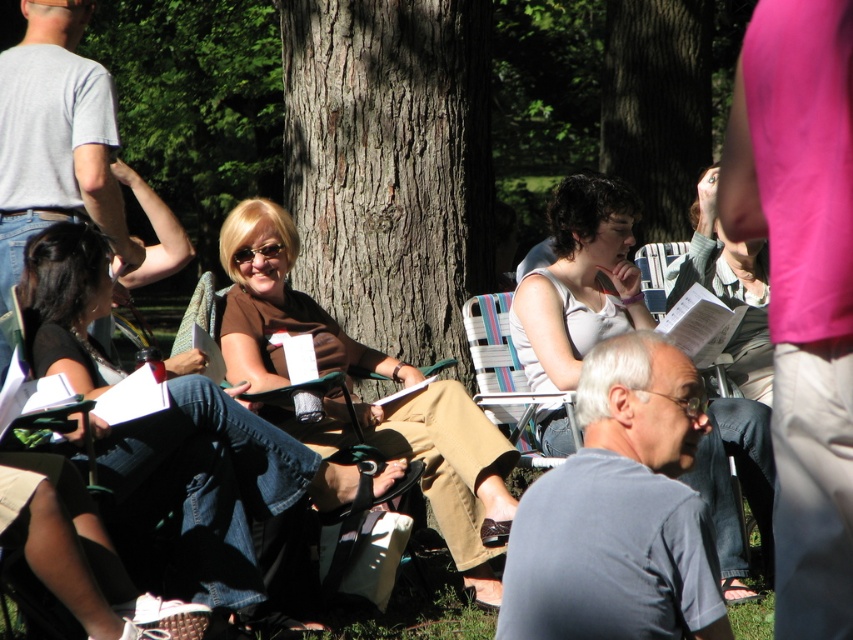
Can you confirm if dark brown textured tree trunk at center is positioned above brown matte shirt at center?

Yes.

Who is positioned more to the left, dark brown textured tree trunk at center or brown matte shirt at center?

From the viewer's perspective, brown matte shirt at center appears more on the left side.

Who is more forward, (326, 253) or (480, 429)?

Point (480, 429)

You are a GUI agent. You are given a task and a screenshot of the screen. Output one action in this format:
    pyautogui.click(x=<x>, y=<y>)
    Task: Click on the dark brown textured tree trunk at center
    The width and height of the screenshot is (853, 640).
    Given the screenshot: What is the action you would take?
    pyautogui.click(x=390, y=164)

Which of these two, matte brown shirt at center or brown matte shirt at center, stands taller?

brown matte shirt at center is taller.

Between point (173, 381) and point (250, 243), which one is positioned behind?

The point (250, 243) is behind.

The width and height of the screenshot is (853, 640). In order to click on matte brown shirt at center in this screenshot , I will do `click(206, 486)`.

The image size is (853, 640). In order to click on matte brown shirt at center in this screenshot , I will do `click(206, 486)`.

Who is higher up, white matte tank top at center or smooth bark tree at center?

smooth bark tree at center

Can you confirm if white matte tank top at center is positioned below smooth bark tree at center?

Indeed, white matte tank top at center is positioned under smooth bark tree at center.

Image resolution: width=853 pixels, height=640 pixels. I want to click on white matte tank top at center, so click(579, 282).

This screenshot has width=853, height=640. I want to click on white matte tank top at center, so click(x=579, y=282).